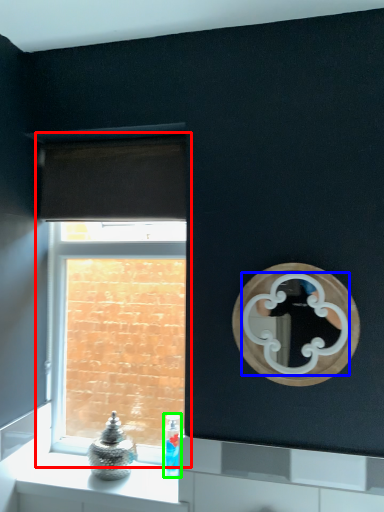
Question: Estimate the real-world distances between objects in this image. Which object is closer to window (highlighted by a red box), mirror (highlighted by a blue box) or toiletry (highlighted by a green box)?

Choices:
 (A) mirror
 (B) toiletry

Answer: (B)